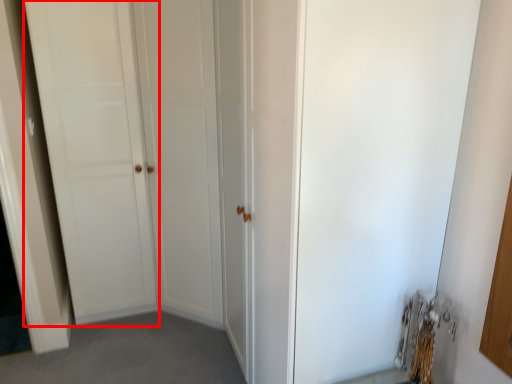
Question: Observing the image, what is the correct spatial positioning of door (annotated by the red box) in reference to screen door?

Choices:
 (A) left
 (B) right

Answer: (A)